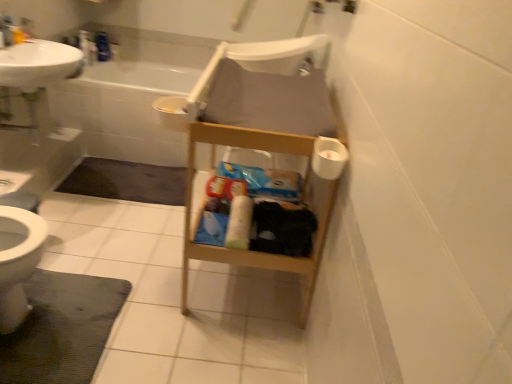
The width and height of the screenshot is (512, 384). Find the location of `vacant space in front of dark gray carpet at lower left, the 2th bath mat positioned from the bottom`. vacant space in front of dark gray carpet at lower left, the 2th bath mat positioned from the bottom is located at coordinates (113, 223).